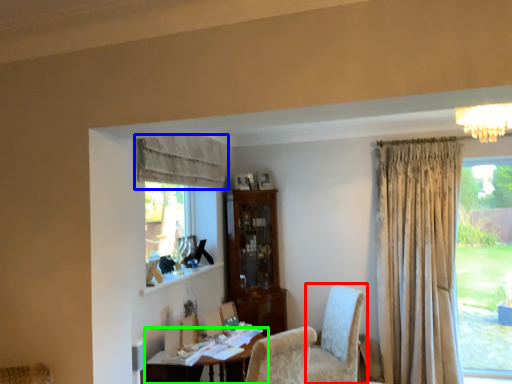
Question: Which object is positioned closest to chair (highlighted by a red box)? Select from curtain (highlighted by a blue box) and table (highlighted by a green box).

Choices:
 (A) curtain
 (B) table

Answer: (B)